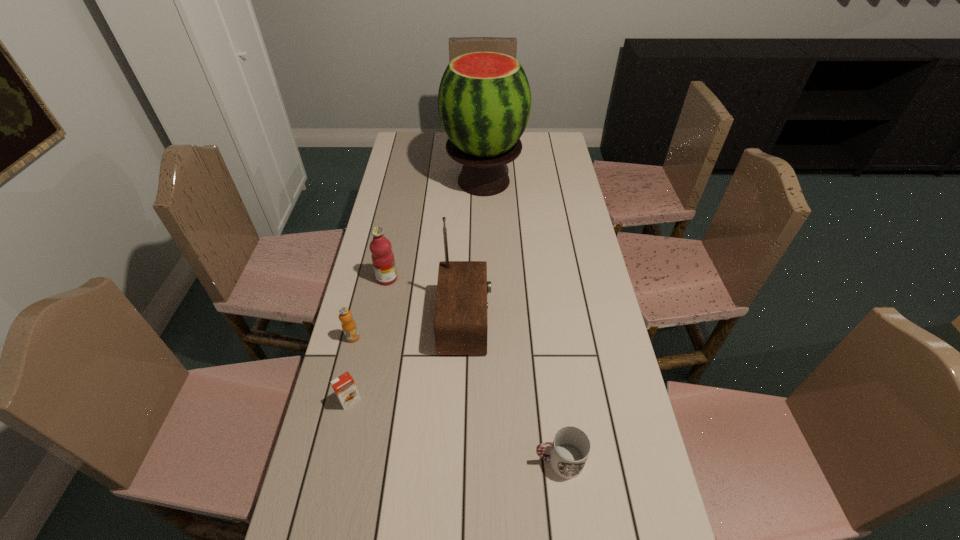
The image size is (960, 540). What are the coordinates of `free space between the second nearest object and the taller orange juice` in the screenshot? It's located at (351, 369).

Locate an element on the screen. unoccupied position between the farther orange juice and the watermelon is located at coordinates (419, 259).

This screenshot has height=540, width=960. I want to click on empty space between the shorter orange juice and the fruit juice, so click(x=369, y=339).

I want to click on object that is the fourth closest to the fifth shortest object, so click(571, 446).

Locate an element on the screen. This screenshot has width=960, height=540. the third closest object relative to the fifth farthest object is located at coordinates (382, 256).

Find the location of a particular element. The image size is (960, 540). free region that satisfies the following two spatial constraints: 1. on the front-facing side of the second tallest object; 2. on the handle side of the nearest object is located at coordinates (462, 461).

I want to click on blank area in the image that satisfies the following two spatial constraints: 1. on the label of the fruit juice; 2. on the front label of the farther orange juice, so click(x=375, y=338).

Where is `vacant space that satisfies the following two spatial constraints: 1. on the front-facing side of the radio receiver; 2. on the handle side of the nearest object`? vacant space that satisfies the following two spatial constraints: 1. on the front-facing side of the radio receiver; 2. on the handle side of the nearest object is located at coordinates (462, 461).

The image size is (960, 540). Identify the location of free space that satisfies the following two spatial constraints: 1. on the handle side of the nearest object; 2. on the front side of the farthest object. (524, 181).

The image size is (960, 540). Find the location of `vacant area in the image that satisfies the following two spatial constraints: 1. on the label of the fourth shortest object; 2. on the handle side of the nearest object`. vacant area in the image that satisfies the following two spatial constraints: 1. on the label of the fourth shortest object; 2. on the handle side of the nearest object is located at coordinates (350, 461).